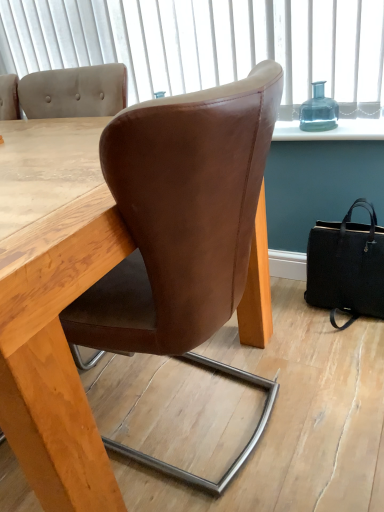
Identify the location of free point above black leather handbag at lower right (from a real-world perspective). This screenshot has height=512, width=384. (357, 217).